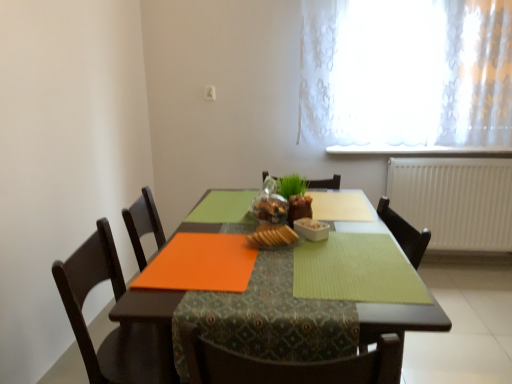
Where is `vacant space in front of white glossy bowl at center`? vacant space in front of white glossy bowl at center is located at coordinates [325, 258].